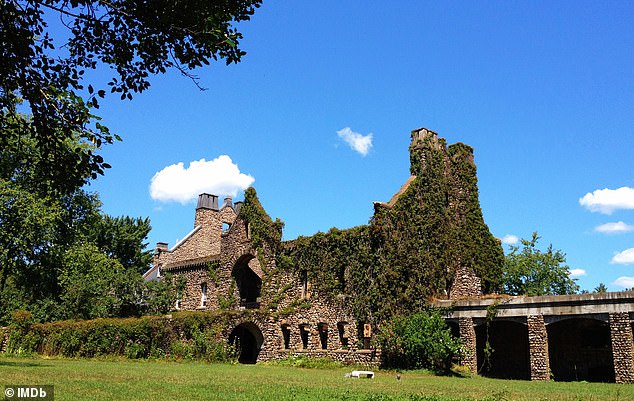
This screenshot has height=401, width=634. I want to click on support column, so click(624, 333), click(538, 341), click(470, 340).